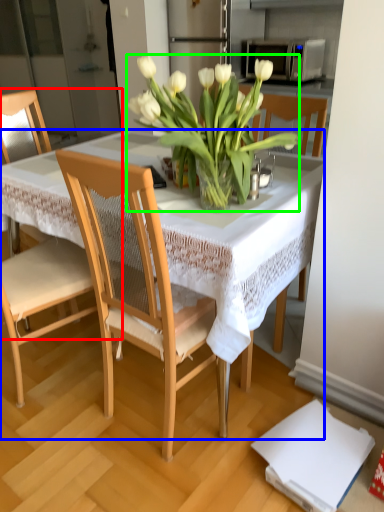
Question: Which object is the farthest from chair (highlighted by a red box)? Choose among these: table (highlighted by a blue box) or flower (highlighted by a green box).

Choices:
 (A) table
 (B) flower

Answer: (B)